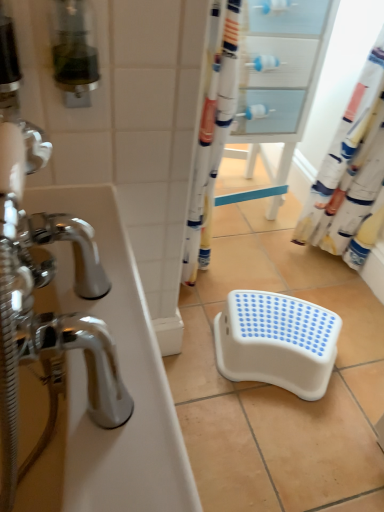
Question: Considering the relative sizes of white glossy bathtub at left and white plastic step stool at center in the image provided, is white glossy bathtub at left smaller than white plastic step stool at center?

Choices:
 (A) no
 (B) yes

Answer: (A)

Question: Is white glossy bathtub at left bigger than white plastic step stool at center?

Choices:
 (A) yes
 (B) no

Answer: (A)

Question: Is white glossy bathtub at left directly adjacent to white plastic step stool at center?

Choices:
 (A) no
 (B) yes

Answer: (A)

Question: From a real-world perspective, is white glossy bathtub at left located higher than white plastic step stool at center?

Choices:
 (A) no
 (B) yes

Answer: (B)

Question: Is white glossy bathtub at left at the left side of white plastic step stool at center?

Choices:
 (A) yes
 (B) no

Answer: (A)

Question: In terms of width, does white plastic step stool at center look wider or thinner when compared to white glossy drawer at upper center?

Choices:
 (A) thin
 (B) wide

Answer: (A)

Question: In the image, is white plastic step stool at center positioned in front of or behind white glossy drawer at upper center?

Choices:
 (A) front
 (B) behind

Answer: (A)

Question: Visually, is white plastic step stool at center positioned to the left or to the right of white glossy drawer at upper center?

Choices:
 (A) left
 (B) right

Answer: (B)

Question: From a real-world perspective, is white plastic step stool at center above or below white glossy drawer at upper center?

Choices:
 (A) above
 (B) below

Answer: (B)

Question: Considering the positions of white glossy drawer at upper center and white plastic step stool at center in the image, is white glossy drawer at upper center wider or thinner than white plastic step stool at center?

Choices:
 (A) wide
 (B) thin

Answer: (A)

Question: Is white glossy drawer at upper center inside the boundaries of white plastic step stool at center, or outside?

Choices:
 (A) outside
 (B) inside

Answer: (A)

Question: Considering the positions of white glossy drawer at upper center and white plastic step stool at center in the image, is white glossy drawer at upper center bigger or smaller than white plastic step stool at center?

Choices:
 (A) small
 (B) big

Answer: (B)

Question: Is point (269, 194) closer or farther from the camera than point (268, 345)?

Choices:
 (A) closer
 (B) farther

Answer: (B)

Question: From the image's perspective, is white glossy bathtub at left positioned above or below white plastic step stool at center?

Choices:
 (A) above
 (B) below

Answer: (A)

Question: In terms of width, does white glossy bathtub at left look wider or thinner when compared to white plastic step stool at center?

Choices:
 (A) wide
 (B) thin

Answer: (B)